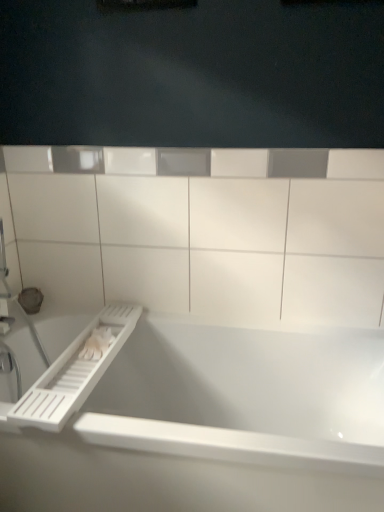
Question: Is point (244, 323) closer or farther from the camera than point (382, 487)?

Choices:
 (A) farther
 (B) closer

Answer: (A)

Question: Relative to white glossy bathtub at center, is white plastic ledge at upper center in front or behind?

Choices:
 (A) front
 (B) behind

Answer: (B)

Question: Considering the real-world distances, which object is farthest from the white glossy bathtub at center?

Choices:
 (A) white plastic towel bar at lower left
 (B) white plastic ledge at upper center

Answer: (B)

Question: Which of these objects is positioned farthest from the white glossy bathtub at center?

Choices:
 (A) white plastic towel bar at lower left
 (B) white plastic ledge at upper center

Answer: (B)